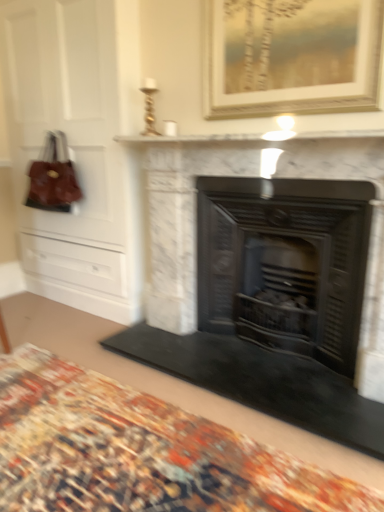
Question: Considering the positions of white marble fireplace at center, the second fireplace when ordered from right to left, and gold-framed painting at upper center in the image, is white marble fireplace at center, the second fireplace when ordered from right to left, wider or thinner than gold-framed painting at upper center?

Choices:
 (A) wide
 (B) thin

Answer: (A)

Question: Visually, is white marble fireplace at center, the second fireplace when ordered from right to left, positioned to the left or to the right of gold-framed painting at upper center?

Choices:
 (A) right
 (B) left

Answer: (B)

Question: Estimate the real-world distances between objects in this image. Which object is farther from the matte brown leather dresser at left?

Choices:
 (A) leather handbag at left
 (B) white marble fireplace at upper center
 (C) black metal fireplace at center, the second fireplace when ordered from left to right
 (D) gold-framed painting at upper center
 (E) white marble fireplace at center, the first fireplace in the left-to-right sequence

Answer: (D)

Question: Considering the real-world distances, which object is farthest from the leather handbag at left?

Choices:
 (A) matte brown leather dresser at left
 (B) black metal fireplace at center, the second fireplace when ordered from left to right
 (C) gold-framed painting at upper center
 (D) carpeted rug at lower center
 (E) white marble fireplace at center, the first fireplace in the left-to-right sequence

Answer: (D)